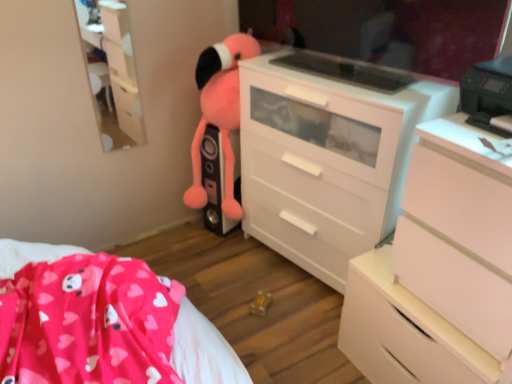
The image size is (512, 384). What do you see at coordinates (328, 154) in the screenshot? I see `white glossy chest of drawers at center, acting as the 2th chest of drawers starting from the front` at bounding box center [328, 154].

This screenshot has height=384, width=512. I want to click on white matte chest of drawers at right, the first chest of drawers viewed from the front, so click(439, 269).

Measure the distance between point [479,47] and camera.

A distance of 4.22 feet exists between point [479,47] and camera.

Find the location of a particular element. Image resolution: width=512 pixels, height=384 pixels. white matte drawer at center is located at coordinates (405, 336).

The height and width of the screenshot is (384, 512). Find the location of `white glossy chest of drawers at center, the first chest of drawers viewed from the back`. white glossy chest of drawers at center, the first chest of drawers viewed from the back is located at coordinates (328, 154).

Does matte white cabinet at upper left have a greater height compared to white glossy chest of drawers at center, acting as the 2th chest of drawers starting from the front?

In fact, matte white cabinet at upper left may be shorter than white glossy chest of drawers at center, acting as the 2th chest of drawers starting from the front.

Are matte white cabinet at upper left and white glossy chest of drawers at center, the first chest of drawers viewed from the back, far apart?

Actually, matte white cabinet at upper left and white glossy chest of drawers at center, the first chest of drawers viewed from the back, are a little close together.

From the image's perspective, between matte white cabinet at upper left and white glossy chest of drawers at center, acting as the 2th chest of drawers starting from the front, who is located below?

white glossy chest of drawers at center, acting as the 2th chest of drawers starting from the front.

How different are the orientations of matte white cabinet at upper left and white glossy chest of drawers at center, acting as the 2th chest of drawers starting from the front, in degrees?

The angle between the facing direction of matte white cabinet at upper left and the facing direction of white glossy chest of drawers at center, acting as the 2th chest of drawers starting from the front, is 78.5 degrees.

From a real-world perspective, relative to glossy plastic mirror at upper center, is white glossy chest of drawers at center, acting as the 2th chest of drawers starting from the front, vertically above or below?

In terms of real-world spatial position, white glossy chest of drawers at center, acting as the 2th chest of drawers starting from the front, is below glossy plastic mirror at upper center.

Is white glossy chest of drawers at center, acting as the 2th chest of drawers starting from the front, bigger or smaller than glossy plastic mirror at upper center?

Clearly, white glossy chest of drawers at center, acting as the 2th chest of drawers starting from the front, is larger in size than glossy plastic mirror at upper center.

Would you say white glossy chest of drawers at center, the first chest of drawers viewed from the back, is outside glossy plastic mirror at upper center?

Yes, white glossy chest of drawers at center, the first chest of drawers viewed from the back, is not within glossy plastic mirror at upper center.

The image size is (512, 384). Identify the location of mirror above the white glossy chest of drawers at center, the first chest of drawers viewed from the back (from the image's perspective). (387, 29).

How different are the orientations of pink plush toy at center and white glossy chest of drawers at center, the first chest of drawers viewed from the back, in degrees?

The angular difference between pink plush toy at center and white glossy chest of drawers at center, the first chest of drawers viewed from the back, is 7.4 degrees.

Considering the relative sizes of pink plush toy at center and white glossy chest of drawers at center, the first chest of drawers viewed from the back, in the image provided, is pink plush toy at center taller than white glossy chest of drawers at center, the first chest of drawers viewed from the back,?

No.

Which object is wider, pink plush toy at center or white glossy chest of drawers at center, the first chest of drawers viewed from the back?

white glossy chest of drawers at center, the first chest of drawers viewed from the back.

Could white glossy chest of drawers at center, acting as the 2th chest of drawers starting from the front, be considered to be inside pink plush toy at center?

Actually, white glossy chest of drawers at center, acting as the 2th chest of drawers starting from the front, is outside pink plush toy at center.

Considering the relative positions of matte white cabinet at upper left and white matte drawer at center in the image provided, is matte white cabinet at upper left to the left of white matte drawer at center from the viewer's perspective?

Yes.

From their relative heights in the image, would you say matte white cabinet at upper left is taller or shorter than white matte drawer at center?

matte white cabinet at upper left is taller than white matte drawer at center.

Would you say white matte drawer at center is part of matte white cabinet at upper left's contents?

No, white matte drawer at center is not surrounded by matte white cabinet at upper left.

Consider the image. Considering the sizes of objects matte white cabinet at upper left and white matte drawer at center in the image provided, who is bigger, matte white cabinet at upper left or white matte drawer at center?

white matte drawer at center.

Is white matte drawer at center turned away from pink plush toy at center?

No, white matte drawer at center is not facing away from pink plush toy at center.

Can you confirm if white matte drawer at center is smaller than pink plush toy at center?

No, white matte drawer at center is not smaller than pink plush toy at center.

Are white matte drawer at center and pink plush toy at center making contact?

No, white matte drawer at center is not next to pink plush toy at center.

This screenshot has height=384, width=512. What are the coordinates of `the chest of drawers that appears above the pink plush toy at center (from a real-world perspective)` in the screenshot? It's located at (439, 269).

Is pink plush toy at center further to camera compared to white matte chest of drawers at right, the first chest of drawers viewed from the front?

Yes, it is.

Who is shorter, pink plush toy at center or white matte chest of drawers at right, the first chest of drawers viewed from the front?

white matte chest of drawers at right, the first chest of drawers viewed from the front.

Measure the distance from white glossy chest of drawers at center, the first chest of drawers viewed from the back, to matte white cabinet at upper left.

white glossy chest of drawers at center, the first chest of drawers viewed from the back, is 89.56 centimeters from matte white cabinet at upper left.

From the image's perspective, would you say white glossy chest of drawers at center, the first chest of drawers viewed from the back, is shown under matte white cabinet at upper left?

Yes, from the image's perspective, white glossy chest of drawers at center, the first chest of drawers viewed from the back, is beneath matte white cabinet at upper left.

From a real-world perspective, does white glossy chest of drawers at center, acting as the 2th chest of drawers starting from the front, sit lower than matte white cabinet at upper left?

Yes, from a real-world perspective, white glossy chest of drawers at center, acting as the 2th chest of drawers starting from the front, is under matte white cabinet at upper left.

Who is smaller, white glossy chest of drawers at center, the first chest of drawers viewed from the back, or matte white cabinet at upper left?

With smaller size is matte white cabinet at upper left.

Where is `tv cabinet lying above the white glossy chest of drawers at center, the first chest of drawers viewed from the back (from the image's perspective)`? tv cabinet lying above the white glossy chest of drawers at center, the first chest of drawers viewed from the back (from the image's perspective) is located at coordinates (112, 72).

The height and width of the screenshot is (384, 512). What are the coordinates of `the chest of drawers that is the 1st object located below the glossy plastic mirror at upper center (from the image's perspective)` in the screenshot? It's located at (328, 154).

When comparing their distances from white glossy chest of drawers at center, the first chest of drawers viewed from the back, does glossy plastic mirror at upper center or white matte chest of drawers at right, the first chest of drawers viewed from the front, seem closer?

The object closer to white glossy chest of drawers at center, the first chest of drawers viewed from the back, is glossy plastic mirror at upper center.

Considering their positions, is matte white cabinet at upper left positioned closer to pink plush toy at center than white glossy chest of drawers at center, the first chest of drawers viewed from the back?

white glossy chest of drawers at center, the first chest of drawers viewed from the back, lies closer to pink plush toy at center than the other object.

Based on their spatial positions, is white glossy chest of drawers at center, acting as the 2th chest of drawers starting from the front, or white matte drawer at center closer to matte white cabinet at upper left?

Based on the image, white glossy chest of drawers at center, acting as the 2th chest of drawers starting from the front, appears to be nearer to matte white cabinet at upper left.

Which object lies further to the anchor point white glossy chest of drawers at center, the first chest of drawers viewed from the back, white matte drawer at center or pink plush toy at center?

white matte drawer at center is positioned further to the anchor white glossy chest of drawers at center, the first chest of drawers viewed from the back.

From the image, which object appears to be farther from matte white cabinet at upper left, white matte drawer at center or white matte chest of drawers at right, which ranks as the second chest of drawers in back-to-front order?

The object further to matte white cabinet at upper left is white matte chest of drawers at right, which ranks as the second chest of drawers in back-to-front order.

From the image, which object appears to be nearer to pink plush toy at center, white matte chest of drawers at right, which ranks as the second chest of drawers in back-to-front order, or white glossy chest of drawers at center, acting as the 2th chest of drawers starting from the front?

white glossy chest of drawers at center, acting as the 2th chest of drawers starting from the front, is closer to pink plush toy at center.

Considering their positions, is white glossy chest of drawers at center, acting as the 2th chest of drawers starting from the front, positioned closer to white matte drawer at center than glossy plastic mirror at upper center?

Among the two, white glossy chest of drawers at center, acting as the 2th chest of drawers starting from the front, is located nearer to white matte drawer at center.

From the image, which object appears to be nearer to glossy plastic mirror at upper center, pink plush toy at center or matte white cabinet at upper left?

The object closer to glossy plastic mirror at upper center is pink plush toy at center.

Locate an element on the screen. This screenshot has height=384, width=512. toy between matte white cabinet at upper left and white matte drawer at center from left to right is located at coordinates (218, 128).

You are a GUI agent. You are given a task and a screenshot of the screen. Output one action in this format:
    pyautogui.click(x=<x>, y=<y>)
    Task: Click on the chest of drawers situated between pink plush toy at center and white matte drawer at center from left to right
    
    Given the screenshot: What is the action you would take?
    pyautogui.click(x=328, y=154)

Locate an element on the screen. The width and height of the screenshot is (512, 384). chest of drawers between matte white cabinet at upper left and white matte drawer at center in the horizontal direction is located at coordinates (328, 154).

What are the coordinates of `mirror situated between pink plush toy at center and white matte chest of drawers at right, which ranks as the second chest of drawers in back-to-front order, from left to right` in the screenshot? It's located at (387, 29).